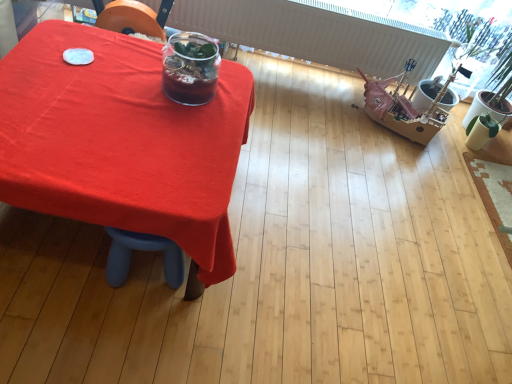
Question: From a real-world perspective, is translucent glass jar at center beneath matte red tablecloth at center?

Choices:
 (A) no
 (B) yes

Answer: (A)

Question: Is translucent glass jar at center taller than matte red tablecloth at center?

Choices:
 (A) no
 (B) yes

Answer: (A)

Question: From a real-world perspective, is translucent glass jar at center over matte red tablecloth at center?

Choices:
 (A) yes
 (B) no

Answer: (A)

Question: Is translucent glass jar at center positioned far away from matte red tablecloth at center?

Choices:
 (A) yes
 (B) no

Answer: (B)

Question: Is translucent glass jar at center at the left side of matte red tablecloth at center?

Choices:
 (A) yes
 (B) no

Answer: (B)

Question: Considering the relative sizes of translucent glass jar at center and matte red tablecloth at center in the image provided, is translucent glass jar at center shorter than matte red tablecloth at center?

Choices:
 (A) no
 (B) yes

Answer: (B)

Question: Does matte red tablecloth at center come behind translucent glass jar at center?

Choices:
 (A) yes
 (B) no

Answer: (B)

Question: Is matte red tablecloth at center positioned beyond the bounds of translucent glass jar at center?

Choices:
 (A) no
 (B) yes

Answer: (B)

Question: From the image's perspective, is matte red tablecloth at center on top of translucent glass jar at center?

Choices:
 (A) yes
 (B) no

Answer: (B)

Question: Considering the relative sizes of matte red tablecloth at center and translucent glass jar at center in the image provided, is matte red tablecloth at center bigger than translucent glass jar at center?

Choices:
 (A) no
 (B) yes

Answer: (B)

Question: Can you confirm if matte red tablecloth at center is smaller than translucent glass jar at center?

Choices:
 (A) no
 (B) yes

Answer: (A)

Question: Is matte red tablecloth at center wider than translucent glass jar at center?

Choices:
 (A) no
 (B) yes

Answer: (B)

Question: Looking at the image, does matte red tablecloth at center seem bigger or smaller compared to translucent glass jar at center?

Choices:
 (A) small
 (B) big

Answer: (B)